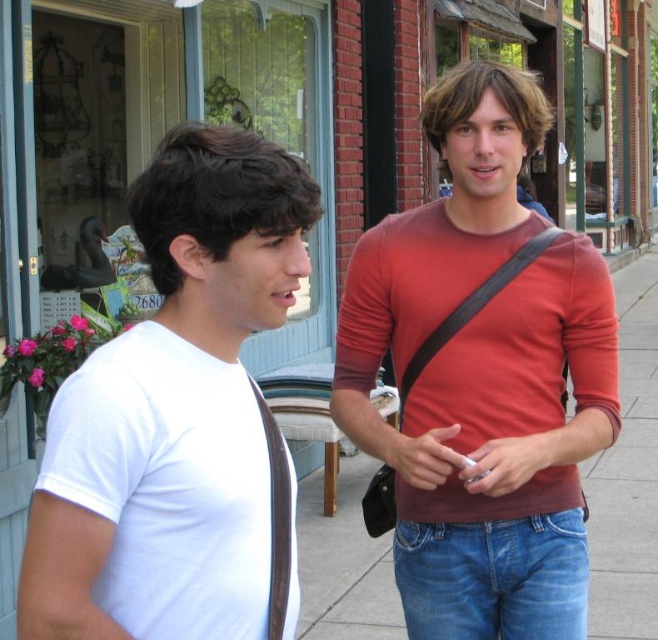
Between matte red shirt at center and white matte t-shirt at left, which one has less height?

white matte t-shirt at left is shorter.

Locate an element on the screen. The image size is (658, 640). matte red shirt at center is located at coordinates (482, 378).

Between point (399, 529) and point (136, 566), which one is positioned behind?

The point (399, 529) is behind.

Identify the location of matte red shirt at center. The width and height of the screenshot is (658, 640). (482, 378).

Is point (305, 259) in front of point (574, 584)?

Yes, it is.

Who is positioned more to the right, white matte t-shirt at left or blue denim jeans at lower right?

blue denim jeans at lower right

Which is behind, point (193, 586) or point (447, 614)?

Positioned behind is point (447, 614).

Locate an element on the screen. Image resolution: width=658 pixels, height=640 pixels. white matte t-shirt at left is located at coordinates (178, 417).

Does point (555, 520) come behind point (572, 536)?

Yes, it is behind point (572, 536).

How much distance is there between matte red shirt at center and blue denim jeans at lower right?

The distance of matte red shirt at center from blue denim jeans at lower right is 7.22 inches.

The image size is (658, 640). I want to click on matte red shirt at center, so click(482, 378).